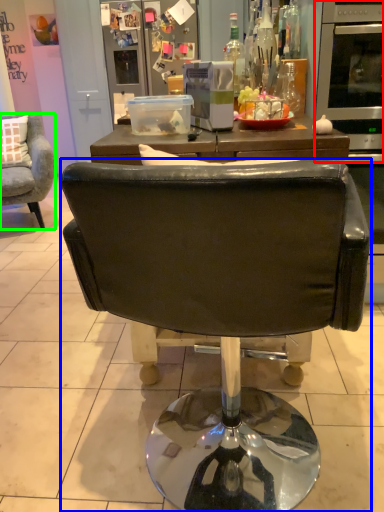
Question: Which object is the farthest from oven (highlighted by a red box)? Choose among these: chair (highlighted by a blue box) or chair (highlighted by a green box).

Choices:
 (A) chair
 (B) chair

Answer: (B)